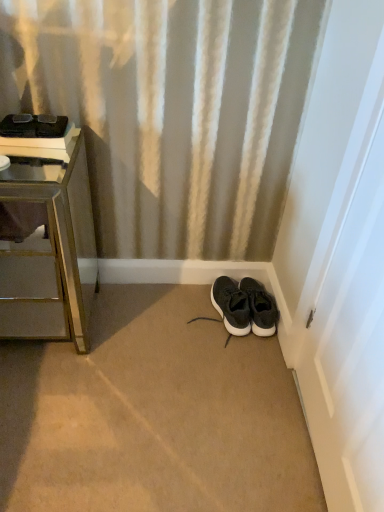
I want to click on free space that is in between white glossy door at right and brushed metal nightstand at left, so click(x=174, y=389).